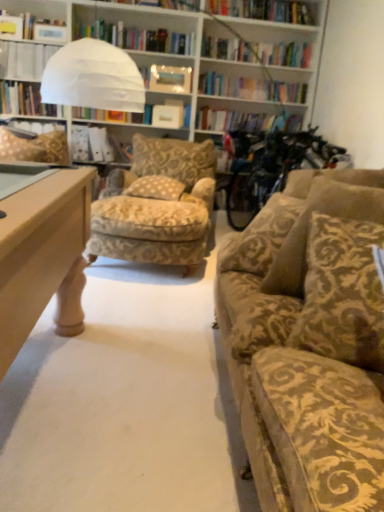
What do you see at coordinates (34, 147) in the screenshot?
I see `gold damask pillow at left, the fourth pillow viewed from the right` at bounding box center [34, 147].

What do you see at coordinates (24, 59) in the screenshot? Image resolution: width=384 pixels, height=512 pixels. I see `white paper at upper left, which is the first book from top to bottom` at bounding box center [24, 59].

Find the location of a particular element. This screenshot has width=384, height=512. gold-patterned fabric chair at center is located at coordinates (157, 205).

What do you see at coordinates (156, 188) in the screenshot? I see `beige damask pillow at center, the 2th pillow viewed from the back` at bounding box center [156, 188].

This screenshot has height=512, width=384. Identify the location of velvet gold-patterned couch at right. (309, 341).

Identify the location of velvet gold pillow at right, positioned as the 1th pillow in right-to-left order. 308,229.

Is gold-patterned fabric chair at center closer to the viewer compared to white paper bag at center, the second book when ordered from left to right?

That is True.

Is gold-patterned fabric chair at center spatially inside white paper bag at center, the second book when ordered from left to right, or outside of it?

gold-patterned fabric chair at center is located beyond the bounds of white paper bag at center, the second book when ordered from left to right.

From the image's perspective, is beige damask pillow at center, which appears as the 3th pillow when viewed from the front, above or below white paper at upper left, marked as the first book in a left-to-right arrangement?

From the image's perspective, beige damask pillow at center, which appears as the 3th pillow when viewed from the front, appears below white paper at upper left, marked as the first book in a left-to-right arrangement.

Is beige damask pillow at center, the 2th pillow when ordered from left to right, located outside white paper at upper left, positioned as the 2th book in bottom-to-top order?

beige damask pillow at center, the 2th pillow when ordered from left to right, is positioned outside white paper at upper left, positioned as the 2th book in bottom-to-top order.

Which object is further away from the camera taking this photo, beige damask pillow at center, the 2th pillow viewed from the back, or white paper at upper left, positioned as the 2th book in bottom-to-top order?

white paper at upper left, positioned as the 2th book in bottom-to-top order, is further from the camera.

Considering the points (160, 183) and (0, 49), which point is in front, point (160, 183) or point (0, 49)?

Positioned in front is point (160, 183).

Are velvet gold pillow at right, positioned as the 1th pillow in right-to-left order, and brown textured pillow at right, marked as the 2th pillow in a right-to-left arrangement, beside each other?

velvet gold pillow at right, positioned as the 1th pillow in right-to-left order, and brown textured pillow at right, marked as the 2th pillow in a right-to-left arrangement, are clearly separated.

Is velvet gold pillow at right, arranged as the third pillow when viewed from the back, facing away from brown textured pillow at right, which is counted as the third pillow, starting from the left?

No, velvet gold pillow at right, arranged as the third pillow when viewed from the back,'s orientation is not away from brown textured pillow at right, which is counted as the third pillow, starting from the left.

Considering the sizes of objects velvet gold pillow at right, positioned as the 2th pillow in front-to-back order, and brown textured pillow at right, which is the 1th pillow from front to back, in the image provided, who is shorter, velvet gold pillow at right, positioned as the 2th pillow in front-to-back order, or brown textured pillow at right, which is the 1th pillow from front to back,?

With less height is velvet gold pillow at right, positioned as the 2th pillow in front-to-back order.

What's the angular difference between gold damask pillow at left, positioned as the first pillow in left-to-right order, and beige damask pillow at center, the 2th pillow when ordered from left to right,'s facing directions?

gold damask pillow at left, positioned as the first pillow in left-to-right order, and beige damask pillow at center, the 2th pillow when ordered from left to right, are facing 33.1 degrees away from each other.

Is gold damask pillow at left, arranged as the fourth pillow when viewed from the front, outside of beige damask pillow at center, which appears as the 3th pillow when viewed from the front?

Yes, gold damask pillow at left, arranged as the fourth pillow when viewed from the front, is outside of beige damask pillow at center, which appears as the 3th pillow when viewed from the front.

Considering the sizes of objects gold damask pillow at left, arranged as the fourth pillow when viewed from the front, and beige damask pillow at center, which is the 3th pillow in right-to-left order, in the image provided, who is shorter, gold damask pillow at left, arranged as the fourth pillow when viewed from the front, or beige damask pillow at center, which is the 3th pillow in right-to-left order,?

With less height is beige damask pillow at center, which is the 3th pillow in right-to-left order.

Which object is further away from the camera taking this photo, gold damask pillow at left, which ranks as the first pillow in back-to-front order, or beige damask pillow at center, the 2th pillow viewed from the back?

gold damask pillow at left, which ranks as the first pillow in back-to-front order, is further away from the camera.

Can you tell me how much white paper at upper left, which is the first book from top to bottom, and velvet gold pillow at right, positioned as the 1th pillow in right-to-left order, differ in facing direction?

The angle between the facing direction of white paper at upper left, which is the first book from top to bottom, and the facing direction of velvet gold pillow at right, positioned as the 1th pillow in right-to-left order, is 53.6 degrees.

Which of these two, white paper at upper left, positioned as the 2th book in bottom-to-top order, or velvet gold pillow at right, arranged as the third pillow when viewed from the back, stands taller?

velvet gold pillow at right, arranged as the third pillow when viewed from the back, is taller.

From the image's perspective, is white paper at upper left, positioned as the 2th book in bottom-to-top order, over velvet gold pillow at right, the 4th pillow in the left-to-right sequence?

Yes.

Looking at this image, is white paper at upper left, which is the first book from top to bottom, further to the viewer compared to velvet gold pillow at right, arranged as the third pillow when viewed from the back?

Yes, it is.

Is white paper bag at center, which ranks as the second book in top-to-bottom order, positioned in front of white paper at upper left, positioned as the 2th book in bottom-to-top order?

No, the depth of white paper bag at center, which ranks as the second book in top-to-bottom order, is greater than that of white paper at upper left, positioned as the 2th book in bottom-to-top order.

The width and height of the screenshot is (384, 512). I want to click on book lying behind the white paper at upper left, marked as the 2th book in a right-to-left arrangement, so click(91, 145).

Between white paper bag at center, which ranks as the 1th book in bottom-to-top order, and white paper at upper left, marked as the 2th book in a right-to-left arrangement, which one has less height?

white paper at upper left, marked as the 2th book in a right-to-left arrangement, is shorter.

From the image's perspective, which is above, white paper bag at center, which ranks as the second book in top-to-bottom order, or white paper at upper left, which is the first book from top to bottom?

white paper at upper left, which is the first book from top to bottom, from the image's perspective.

Is velvet gold pillow at right, positioned as the 1th pillow in right-to-left order, positioned in front of white paper bag at center, which ranks as the 1th book in bottom-to-top order?

Yes, velvet gold pillow at right, positioned as the 1th pillow in right-to-left order, is closer to the viewer.

Between velvet gold pillow at right, positioned as the 1th pillow in right-to-left order, and white paper bag at center, which is the 1th book from right to left, which one appears on the left side from the viewer's perspective?

white paper bag at center, which is the 1th book from right to left, is more to the left.

In the scene shown: Considering the relative sizes of velvet gold pillow at right, arranged as the third pillow when viewed from the back, and white paper bag at center, which ranks as the 1th book in bottom-to-top order, in the image provided, is velvet gold pillow at right, arranged as the third pillow when viewed from the back, smaller than white paper bag at center, which ranks as the 1th book in bottom-to-top order,?

No.

In order to click on chair that is in front of the white paper bag at center, which is the 1th book from right to left in this screenshot , I will do `click(157, 205)`.

Locate an element on the screen. This screenshot has width=384, height=512. the 2nd book above the beige damask pillow at center, the 2th pillow viewed from the back (from the image's perspective) is located at coordinates (24, 59).

Considering their positions, is velvet gold-patterned couch at right positioned further to velvet gold pillow at right, arranged as the third pillow when viewed from the back, than white paper at upper left, marked as the first book in a left-to-right arrangement?

The object further to velvet gold pillow at right, arranged as the third pillow when viewed from the back, is white paper at upper left, marked as the first book in a left-to-right arrangement.

When comparing their distances from beige damask pillow at center, the 2th pillow when ordered from left to right, does gold-patterned fabric chair at center or velvet gold-patterned couch at right seem closer?

gold-patterned fabric chair at center lies closer to beige damask pillow at center, the 2th pillow when ordered from left to right, than the other object.

From the picture: Looking at the image, which one is located further to velvet gold-patterned couch at right, white paper at upper left, which is the first book from top to bottom, or gold-patterned fabric chair at center?

Based on the image, white paper at upper left, which is the first book from top to bottom, appears to be further to velvet gold-patterned couch at right.

Estimate the real-world distances between objects in this image. Which object is further from white paper bag at center, which is the 1th book from right to left, gold-patterned fabric chair at center or beige damask pillow at center, the 2th pillow when ordered from left to right?

Based on the image, beige damask pillow at center, the 2th pillow when ordered from left to right, appears to be further to white paper bag at center, which is the 1th book from right to left.

Estimate the real-world distances between objects in this image. Which object is further from gold-patterned fabric chair at center, velvet gold pillow at right, positioned as the 1th pillow in right-to-left order, or white paper bag at center, the second book when ordered from left to right?

velvet gold pillow at right, positioned as the 1th pillow in right-to-left order, lies further to gold-patterned fabric chair at center than the other object.

Which object lies further to the anchor point velvet gold-patterned couch at right, beige damask pillow at center, which is the 3th pillow in right-to-left order, or velvet gold pillow at right, positioned as the 1th pillow in right-to-left order?

beige damask pillow at center, which is the 3th pillow in right-to-left order.

Estimate the real-world distances between objects in this image. Which object is closer to gold-patterned fabric chair at center, brown textured pillow at right, placed as the 4th pillow when sorted from back to front, or beige damask pillow at center, which appears as the 3th pillow when viewed from the front?

Based on the image, beige damask pillow at center, which appears as the 3th pillow when viewed from the front, appears to be nearer to gold-patterned fabric chair at center.

Looking at the image, which one is located further to gold-patterned fabric chair at center, gold damask pillow at left, which ranks as the first pillow in back-to-front order, or white paper at upper left, marked as the first book in a left-to-right arrangement?

white paper at upper left, marked as the first book in a left-to-right arrangement, lies further to gold-patterned fabric chair at center than the other object.

Locate an element on the screen. This screenshot has width=384, height=512. studio couch between brown textured pillow at right, marked as the 2th pillow in a right-to-left arrangement, and velvet gold pillow at right, the 4th pillow in the left-to-right sequence, along the z-axis is located at coordinates (309, 341).

At what (x,y) coordinates should I click in order to perform the action: click on studio couch positioned between brown textured pillow at right, marked as the 2th pillow in a right-to-left arrangement, and gold damask pillow at left, the fourth pillow viewed from the right, from near to far. Please return your answer as a coordinate pair (x, y). Image resolution: width=384 pixels, height=512 pixels. Looking at the image, I should click on (309, 341).

Locate an element on the screen. The width and height of the screenshot is (384, 512). chair between velvet gold-patterned couch at right and gold damask pillow at left, arranged as the fourth pillow when viewed from the front, from front to back is located at coordinates (157, 205).

Identify the location of pillow located between brown textured pillow at right, which is the 1th pillow from front to back, and beige damask pillow at center, the 2th pillow viewed from the back, in the depth direction. [308, 229].